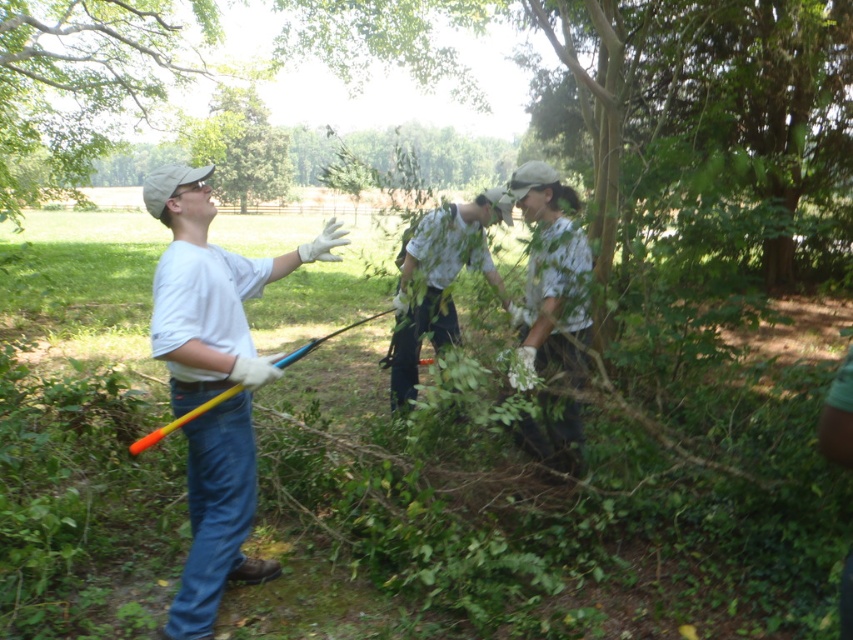
You are standing at the point labeled point (78, 152) and want to walk to the point labeled point (236, 403). Which direction should you face to walk towards your destination?

You should face towards the direction of point (236, 403), which is in front of point (78, 152), so you should face forward to walk towards it.

You are a photographer trying to capture the entire scene in one shot. Given that the green leafy tree at upper left and the white cotton shirt at center are both in your frame, which object should you focus on first to ensure both are clearly visible?

You should focus on the green leafy tree at upper left first because it is larger in size than the white cotton shirt at center, making it more prominent in the frame.